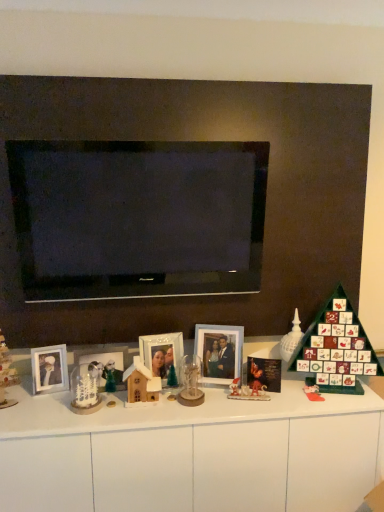
Find the location of a particular element. green matte advent calendar at right is located at coordinates (336, 348).

Measure the distance between point [3,401] and camera.

Point [3,401] and camera are 1.78 meters apart.

Find the location of a particular element. This screenshot has height=512, width=384. white glossy dresser at center is located at coordinates (192, 454).

Locate an element on the screen. matte silver picture frame at left, the 3th picture frame viewed from the right is located at coordinates (49, 369).

Identify the location of white frosted glass candle holder at lower left, positioned as the first candle holder in left-to-right order. The height and width of the screenshot is (512, 384). (85, 389).

At what (x,y) coordinates should I click in order to perform the action: click on green matte advent calendar at right. Please return your answer as a coordinate pair (x, y). Looking at the image, I should click on (336, 348).

Can you confirm if white glossy dresser at center is wider than green matte advent calendar at right?

Correct, the width of white glossy dresser at center exceeds that of green matte advent calendar at right.

Is white glossy dresser at center facing away from green matte advent calendar at right?

No.

Is point (83, 453) closer to viewer compared to point (312, 348)?

That is True.

Based on the photo, from a real-world perspective, is white glossy dresser at center above or below green matte advent calendar at right?

In terms of real-world spatial position, white glossy dresser at center is below green matte advent calendar at right.

In the scene shown: Who is bigger, green matte advent calendar at right or clear glass candle holder at center, which is the 1th candle holder in right-to-left order?

Bigger between the two is green matte advent calendar at right.

Considering the sizes of green matte advent calendar at right and clear glass candle holder at center, which is the 1th candle holder in right-to-left order, in the image, is green matte advent calendar at right taller or shorter than clear glass candle holder at center, which is the 1th candle holder in right-to-left order,?

Considering their sizes, green matte advent calendar at right has more height than clear glass candle holder at center, which is the 1th candle holder in right-to-left order.

Is the depth of green matte advent calendar at right greater than that of clear glass candle holder at center, which is the 1th candle holder in right-to-left order?

Yes, green matte advent calendar at right is further from the viewer.

Is point (339, 294) closer or farther from the camera than point (200, 390)?

Point (339, 294) is positioned farther from the camera compared to point (200, 390).

Considering the positions of points (312, 325) and (308, 382), is point (312, 325) farther from camera compared to point (308, 382)?

Yes, point (312, 325) is farther from viewer.

At what (x,y) coordinates should I click in order to perform the action: click on shelf that is above the matte plastic toy at right, which is the 3th toy in left-to-right order (from the image's perspective). Please return your answer as a coordinate pair (x, y). This screenshot has height=512, width=384. Looking at the image, I should click on (336, 348).

Can we say green matte advent calendar at right lies outside matte plastic toy at right, which is the 3th toy in left-to-right order?

Absolutely, green matte advent calendar at right is external to matte plastic toy at right, which is the 3th toy in left-to-right order.

From the image's perspective, is matte plastic toy at right, arranged as the second toy when viewed from the back, located above or below matte silver picture frame at left, the 3th picture frame viewed from the right?

Clearly, from the image's perspective, matte plastic toy at right, arranged as the second toy when viewed from the back, is below matte silver picture frame at left, the 3th picture frame viewed from the right.

Considering the relative positions of matte plastic toy at right, arranged as the second toy when viewed from the back, and matte silver picture frame at left, the 3th picture frame viewed from the right, in the image provided, is matte plastic toy at right, arranged as the second toy when viewed from the back, to the left of matte silver picture frame at left, the 3th picture frame viewed from the right, from the viewer's perspective?

No, matte plastic toy at right, arranged as the second toy when viewed from the back, is not to the left of matte silver picture frame at left, the 3th picture frame viewed from the right.

Looking at this image, between matte silver picture frame at left, the 3th picture frame viewed from the right, and clear glass candle holder at center, which is the 1th candle holder in right-to-left order, which one has smaller width?

matte silver picture frame at left, the 3th picture frame viewed from the right.

Which picture frame is the 2nd one when counting from the left side of the clear glass candle holder at center, which is the 1th candle holder in right-to-left order? Please provide its 2D coordinates.

[(49, 369)]

Does point (67, 367) come behind point (188, 403)?

Yes, point (67, 367) is behind point (188, 403).

Is clear glass candle holder at center, which is the 1th candle holder in right-to-left order, at the back of matte silver picture frame at left, the 3th picture frame viewed from the right?

No.

Between white frosted glass candle holder at lower left, arranged as the 2th candle holder when viewed from the right, and white glossy seashell at right, the 2th toy positioned from the left, which one has larger width?

With larger width is white glossy seashell at right, the 2th toy positioned from the left.

Is white frosted glass candle holder at lower left, arranged as the 2th candle holder when viewed from the right, outside of white glossy seashell at right, the 2th toy positioned from the left?

white frosted glass candle holder at lower left, arranged as the 2th candle holder when viewed from the right, is positioned outside white glossy seashell at right, the 2th toy positioned from the left.

Between white frosted glass candle holder at lower left, arranged as the 2th candle holder when viewed from the right, and white glossy seashell at right, the third toy when ordered from front to back, which one has larger size?

Bigger between the two is white glossy seashell at right, the third toy when ordered from front to back.

Could you tell me if white frosted glass candle holder at lower left, positioned as the first candle holder in left-to-right order, is turned towards white glossy seashell at right, which appears as the first toy when viewed from the back?

No, white frosted glass candle holder at lower left, positioned as the first candle holder in left-to-right order, is not turned towards white glossy seashell at right, which appears as the first toy when viewed from the back.

Is the depth of wooden house at center, the third toy viewed from the right, greater than that of white frosted glass candle holder at lower left, positioned as the first candle holder in left-to-right order?

Yes, the depth of wooden house at center, the third toy viewed from the right, is greater than that of white frosted glass candle holder at lower left, positioned as the first candle holder in left-to-right order.

How different are the orientations of wooden house at center, the third toy viewed from the right, and white frosted glass candle holder at lower left, arranged as the 2th candle holder when viewed from the right, in degrees?

There is a 0.668-degree angle between the facing directions of wooden house at center, the third toy viewed from the right, and white frosted glass candle holder at lower left, arranged as the 2th candle holder when viewed from the right.

Is wooden house at center, the third toy viewed from the right, turned away from white frosted glass candle holder at lower left, positioned as the first candle holder in left-to-right order?

No, wooden house at center, the third toy viewed from the right, is not facing away from white frosted glass candle holder at lower left, positioned as the first candle holder in left-to-right order.

Is wooden house at center, which appears as the first toy when viewed from the front, beside white frosted glass candle holder at lower left, arranged as the 2th candle holder when viewed from the right?

No, wooden house at center, which appears as the first toy when viewed from the front, is not touching white frosted glass candle holder at lower left, arranged as the 2th candle holder when viewed from the right.

Identify the location of shelf located on the right of white glossy dresser at center. This screenshot has width=384, height=512. (336, 348).

You are a GUI agent. You are given a task and a screenshot of the screen. Output one action in this format:
    pyautogui.click(x=<x>, y=<y>)
    Task: Click on the shelf lying behind the clear glass candle holder at center, arranged as the 2th candle holder when viewed from the left
    The height and width of the screenshot is (512, 384).
    Given the screenshot: What is the action you would take?
    pyautogui.click(x=336, y=348)

Looking at the image, which one is located closer to clear glass candle holder at center, arranged as the 2th candle holder when viewed from the left, white glossy picture frame at center, the 2th picture frame positioned from the left, or matte silver picture frame at left, placed as the first picture frame when sorted from left to right?

Based on the image, white glossy picture frame at center, the 2th picture frame positioned from the left, appears to be nearer to clear glass candle holder at center, arranged as the 2th candle holder when viewed from the left.

Consider the image. Considering their positions, is white glossy dresser at center positioned closer to green matte advent calendar at right than clear glass candle holder at center, which is the 1th candle holder in right-to-left order?

white glossy dresser at center is positioned closer to the anchor green matte advent calendar at right.

When comparing their distances from white glossy dresser at center, does matte plastic toy at right, which is counted as the second toy, starting from the front, or white glossy seashell at right, which is the second toy from right to left, seem closer?

Among the two, matte plastic toy at right, which is counted as the second toy, starting from the front, is located nearer to white glossy dresser at center.

Considering their positions, is white glossy dresser at center positioned closer to white glossy picture frame at center, the 2th picture frame positioned from the left, than matte white glass dome at lower left?

white glossy dresser at center is positioned closer to the anchor white glossy picture frame at center, the 2th picture frame positioned from the left.

Based on the photo, when comparing their distances from clear glass candle holder at center, which is the 1th candle holder in right-to-left order, does white glossy picture frame at center, the third picture frame viewed from the left, or white glossy picture frame at center, the 2th picture frame positioned from the left, seem further?

white glossy picture frame at center, the third picture frame viewed from the left, is positioned further to the anchor clear glass candle holder at center, which is the 1th candle holder in right-to-left order.

When comparing their distances from white glossy seashell at right, which appears as the first toy when viewed from the back, does clear glass candle holder at center, arranged as the 2th candle holder when viewed from the left, or matte silver picture frame at left, placed as the first picture frame when sorted from left to right, seem further?

matte silver picture frame at left, placed as the first picture frame when sorted from left to right, is positioned further to the anchor white glossy seashell at right, which appears as the first toy when viewed from the back.

From the image, which object appears to be nearer to green matte advent calendar at right, clear glass candle holder at center, arranged as the 2th candle holder when viewed from the left, or matte plastic toy at right, the first toy positioned from the right?

matte plastic toy at right, the first toy positioned from the right, lies closer to green matte advent calendar at right than the other object.

Looking at the image, which one is located closer to clear glass candle holder at center, which is the 1th candle holder in right-to-left order, matte white glass dome at lower left or white glossy seashell at right, the third toy when ordered from front to back?

white glossy seashell at right, the third toy when ordered from front to back, is closer to clear glass candle holder at center, which is the 1th candle holder in right-to-left order.

Locate an element on the screen. The height and width of the screenshot is (512, 384). picture frame between matte white glass dome at lower left and white glossy picture frame at center, the 2th picture frame positioned from the left, in the horizontal direction is located at coordinates (49, 369).

You are a GUI agent. You are given a task and a screenshot of the screen. Output one action in this format:
    pyautogui.click(x=<x>, y=<y>)
    Task: Click on the dresser situated between wooden house at center, the third toy viewed from the back, and white glossy seashell at right, which is the second toy from right to left, from left to right
    The width and height of the screenshot is (384, 512).
    Given the screenshot: What is the action you would take?
    pyautogui.click(x=192, y=454)

Locate an element on the screen. The width and height of the screenshot is (384, 512). candle holder located between white frosted glass candle holder at lower left, positioned as the first candle holder in left-to-right order, and white glossy picture frame at center, the third picture frame viewed from the left, in the left-right direction is located at coordinates (191, 382).

At what (x,y) coordinates should I click in order to perform the action: click on toy between white frosted glass candle holder at lower left, arranged as the 2th candle holder when viewed from the right, and white glossy picture frame at center, arranged as the second picture frame when viewed from the right, in the horizontal direction. Please return your answer as a coordinate pair (x, y). The height and width of the screenshot is (512, 384). Looking at the image, I should click on (141, 383).